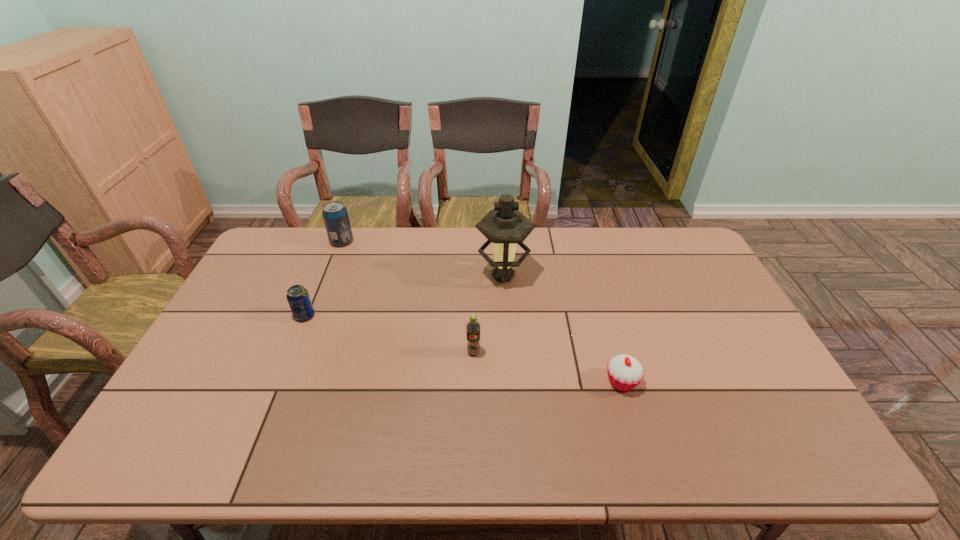
Where is `vacant region between the nearest soda and the farthest soda`? vacant region between the nearest soda and the farthest soda is located at coordinates (408, 297).

Identify the location of object that is the second nearest to the rightmost object. (505, 226).

Identify which object is located as the third nearest to the cupcake. Please provide its 2D coordinates. Your answer should be formatted as a tuple, i.e. [(x, y)], where the tuple contains the x and y coordinates of a point satisfying the conditions above.

[(298, 297)]

Locate an element on the screen. The height and width of the screenshot is (540, 960). soda that is the closest to the cupcake is located at coordinates (473, 327).

The image size is (960, 540). I want to click on soda that stands as the closest to the nearest soda, so click(x=298, y=297).

This screenshot has height=540, width=960. I want to click on vacant space that satisfies the following two spatial constraints: 1. on the front label of the rightmost soda; 2. on the left side of the nearest object, so click(x=473, y=382).

You are a GUI agent. You are given a task and a screenshot of the screen. Output one action in this format:
    pyautogui.click(x=<x>, y=<y>)
    Task: Click on the free space that satisfies the following two spatial constraints: 1. on the front side of the nearest object; 2. on the left side of the farthest soda
    This screenshot has height=540, width=960.
    Given the screenshot: What is the action you would take?
    pyautogui.click(x=286, y=382)

Locate an element on the screen. This screenshot has height=540, width=960. vacant space that satisfies the following two spatial constraints: 1. on the back side of the farthest object; 2. on the left side of the shortest soda is located at coordinates (336, 241).